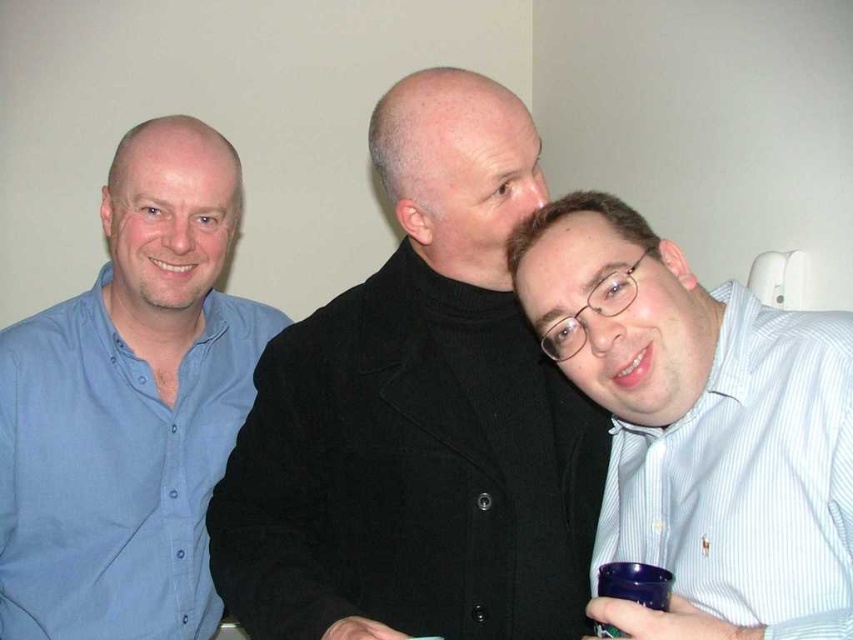
Question: Considering the real-world distances, which object is farthest from the blue cotton shirt at left?

Choices:
 (A) black matte coat at center
 (B) blue plastic cup at lower right

Answer: (B)

Question: Estimate the real-world distances between objects in this image. Which object is closer to the blue cotton shirt at left?

Choices:
 (A) black matte coat at center
 (B) white striped shirt at right

Answer: (A)

Question: Can you confirm if white striped shirt at right is thinner than blue plastic cup at lower right?

Choices:
 (A) no
 (B) yes

Answer: (A)

Question: Does blue cotton shirt at left have a greater width compared to blue plastic cup at lower right?

Choices:
 (A) yes
 (B) no

Answer: (A)

Question: Is blue cotton shirt at left closer to camera compared to blue plastic cup at lower right?

Choices:
 (A) no
 (B) yes

Answer: (A)

Question: Which is farther from the white striped shirt at right?

Choices:
 (A) blue plastic cup at lower right
 (B) black matte coat at center
 (C) blue cotton shirt at left

Answer: (C)